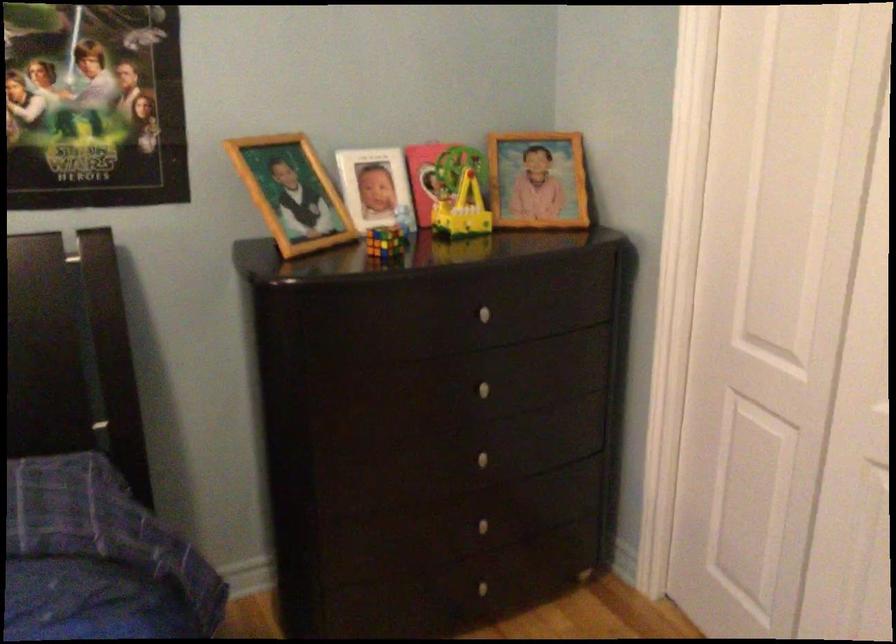
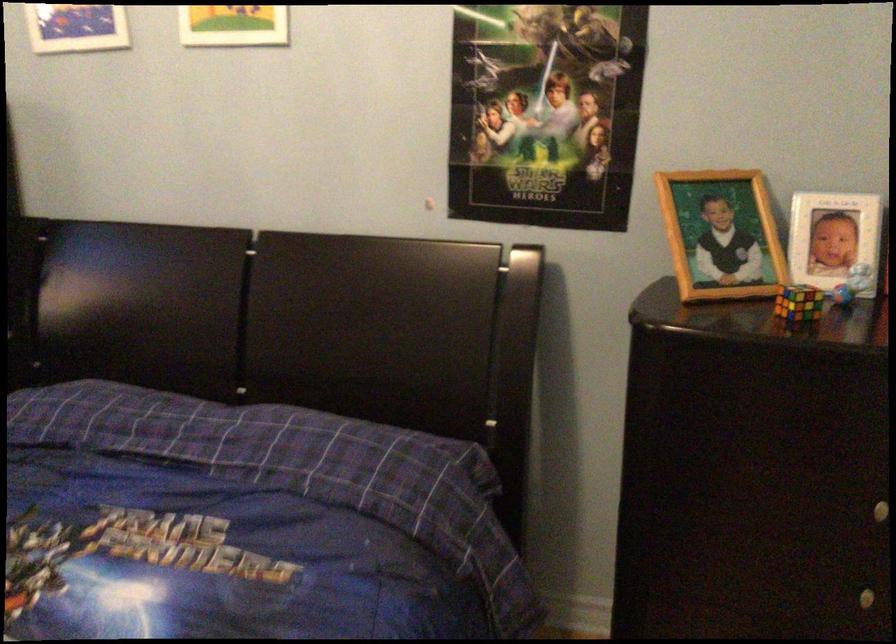
Locate, in the second image, the point that corresponds to (294,190) in the first image.

(720, 234)